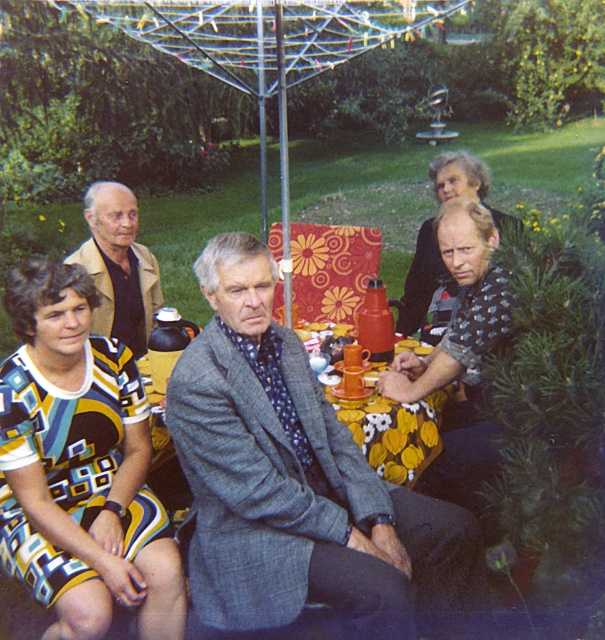
Is point (385, 595) farther from viewer compared to point (67, 324)?

That is False.

Does gray woolen suit at center have a greater height compared to geometric print dress at lower left?

Yes.

Find the location of a particular element. gray woolen suit at center is located at coordinates (295, 481).

Is the position of geometric print dress at lower left more distant than that of patterned fabric dress at center?

No.

Who is lower down, geometric print dress at lower left or patterned fabric dress at center?

geometric print dress at lower left is below.

Does point (65, 316) come farther from viewer compared to point (500, 216)?

No, (65, 316) is in front of (500, 216).

Find the location of `geometric print dress at lower left`. geometric print dress at lower left is located at coordinates (79, 465).

Which is in front, point (473, 592) or point (106, 232)?

Positioned in front is point (473, 592).

Between gray woolen suit at center and light brown leather jacket at upper left, which one has more height?

With more height is gray woolen suit at center.

This screenshot has width=605, height=640. Describe the element at coordinates (295, 481) in the screenshot. I see `gray woolen suit at center` at that location.

The image size is (605, 640). Identify the location of gray woolen suit at center. (295, 481).